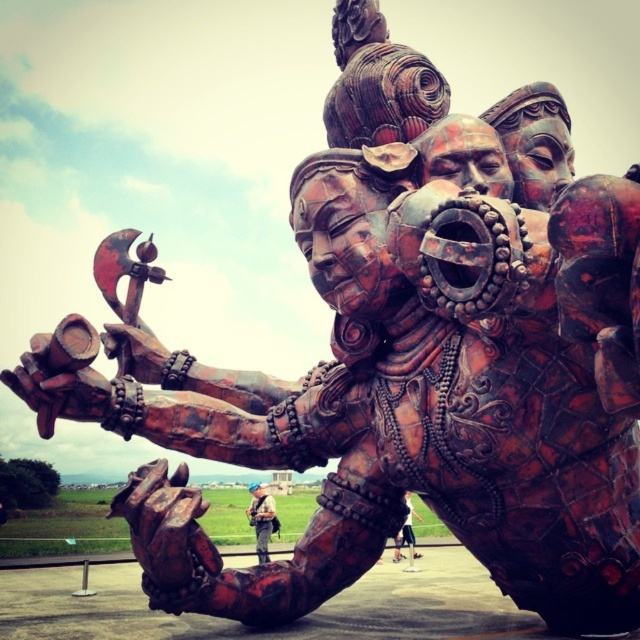
You are a photographer standing at the camera position. You want to take a closeup shot of the metallic helmet at center. Considering the distance, do you need to use a zoom lens?

The metallic helmet at center is 183.67 feet from the camera. To capture a closeup shot from that distance, you would need to use a zoom lens to magnify the subject sufficiently.

You are an art conservator examining the statue. You need to clean both the metallic helmet at center and the matte brown leather jacket at lower center. Which object should you start with to avoid having to move the ladder closer or further away after finishing the first?

You should start with the metallic helmet at center because it is closer to you than the matte brown leather jacket at lower center, so once you finish cleaning it, you won